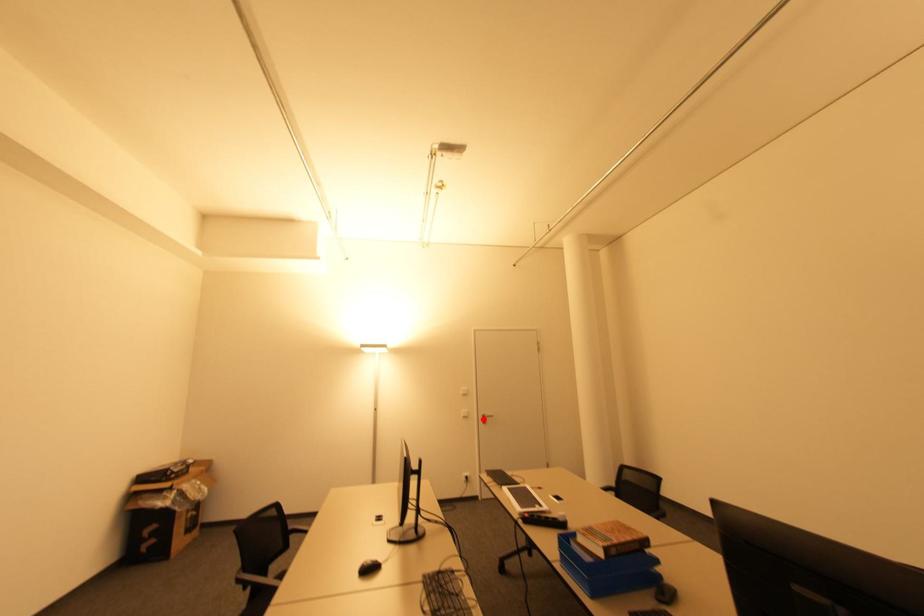
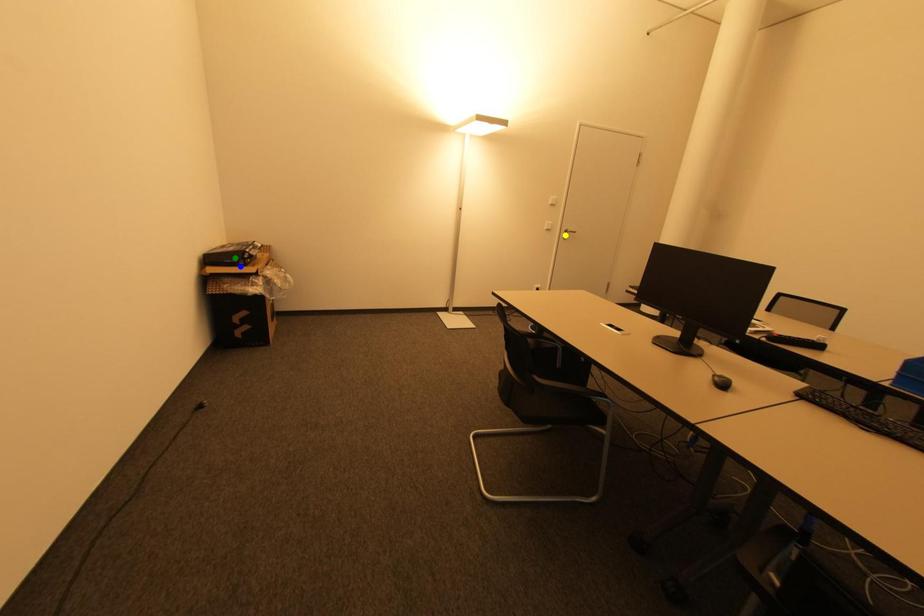
Question: I am providing you with two images of the same scene from different viewpoints. A red point is marked on the first image. You are given multiple points on the second image. Which point in image 2 is actually the same real-world point as the red point in image 1?

Choices:
 (A) yellow point
 (B) green point
 (C) blue point

Answer: (A)